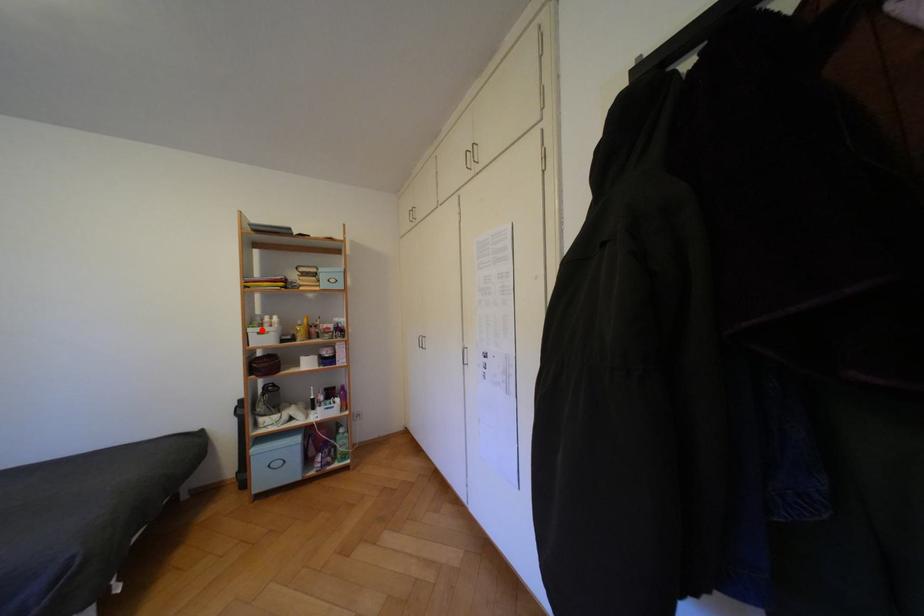
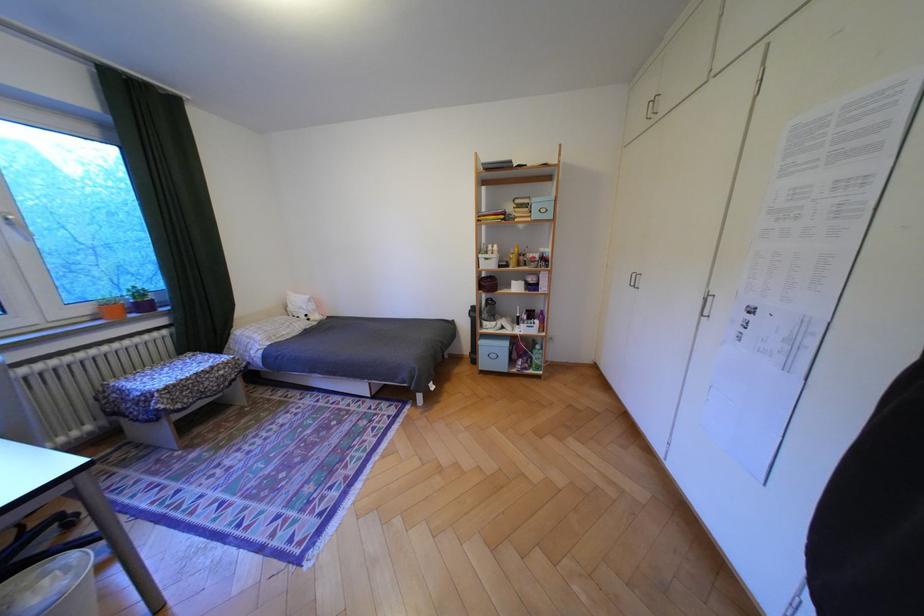
Question: I am providing you with two images of the same scene from different viewpoints. A red point is marked on the first image. Can you still see the location of the red point in image 2?

Choices:
 (A) Yes
 (B) No

Answer: (A)